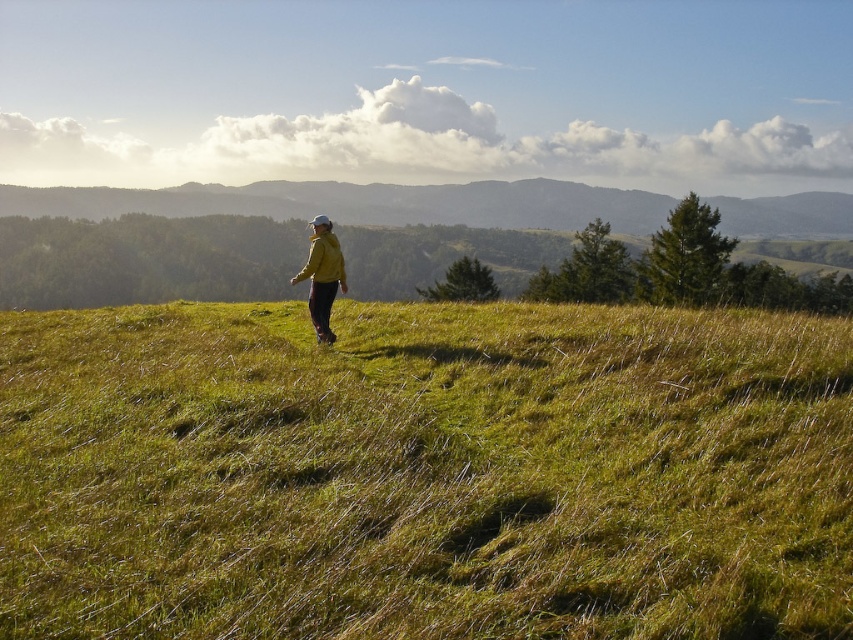
Does yellow matte jacket at center appear under matte yellow jacket at center?

Yes.

Between point (309, 248) and point (325, 276), which one is positioned behind?

The point (325, 276) is more distant.

Who is more forward, (331, 225) or (312, 257)?

Point (312, 257) is more forward.

Where is `yellow matte jacket at center`? The width and height of the screenshot is (853, 640). yellow matte jacket at center is located at coordinates (322, 275).

Which is behind, point (149, 314) or point (312, 236)?

Point (149, 314)

Does green grassy hillside at center appear under matte yellow jacket at center?

Correct, green grassy hillside at center is located below matte yellow jacket at center.

Is point (189, 381) farther from viewer compared to point (334, 244)?

No, (189, 381) is in front of (334, 244).

Where is `green grassy hillside at center`? This screenshot has height=640, width=853. green grassy hillside at center is located at coordinates (424, 472).

Does green grassy hillside at center have a lesser height compared to yellow matte jacket at center?

In fact, green grassy hillside at center may be taller than yellow matte jacket at center.

Who is more distant from viewer, (149, 499) or (332, 298)?

Point (332, 298)

What are the coordinates of `green grassy hillside at center` in the screenshot? It's located at (424, 472).